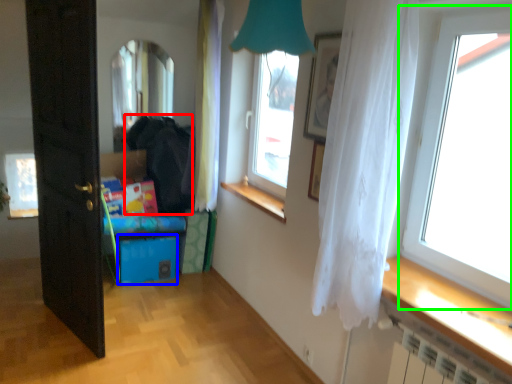
Question: Considering the real-world distances, which object is farthest from dark (highlighted by a red box)? storage box (highlighted by a blue box) or window (highlighted by a green box)?

Choices:
 (A) storage box
 (B) window

Answer: (B)